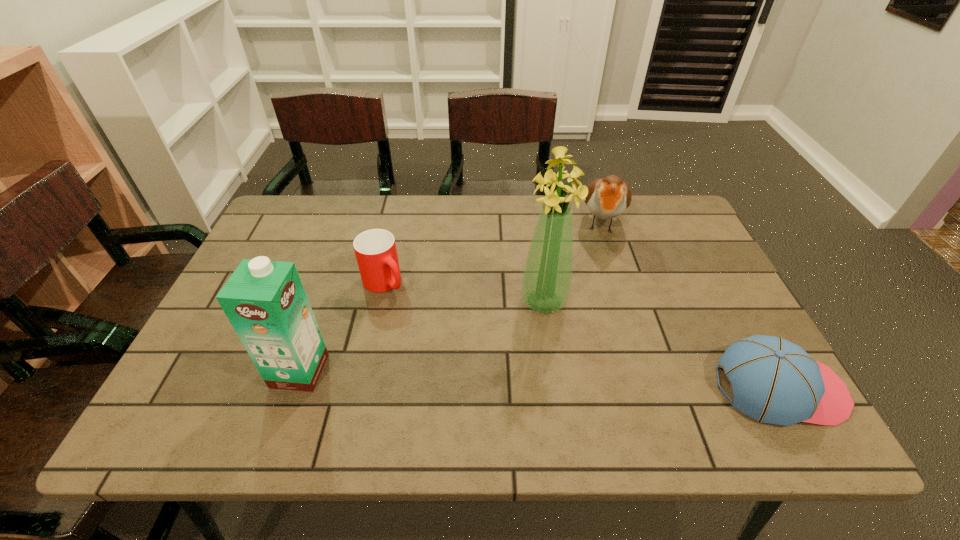
You are a GUI agent. You are given a task and a screenshot of the screen. Output one action in this format:
    pyautogui.click(x=<x>, y=<y>)
    Task: Click on the baseball cap that is at the near edge
    
    Given the screenshot: What is the action you would take?
    pyautogui.click(x=773, y=380)

Identify the location of object at the right edge. The height and width of the screenshot is (540, 960). (773, 380).

You are a GUI agent. You are given a task and a screenshot of the screen. Output one action in this format:
    pyautogui.click(x=<x>, y=<y>)
    Task: Click on the object present at the near right corner
    The width and height of the screenshot is (960, 540).
    Given the screenshot: What is the action you would take?
    pyautogui.click(x=773, y=380)

Image resolution: width=960 pixels, height=540 pixels. What are the coordinates of `vacant space at the far edge of the desktop` in the screenshot? It's located at click(331, 239).

This screenshot has width=960, height=540. I want to click on free location at the near edge, so click(x=402, y=386).

At what (x,y) coordinates should I click in order to perform the action: click on vacant space at the right edge of the desktop. Please return your answer as a coordinate pair (x, y). The image size is (960, 540). Looking at the image, I should click on tap(709, 331).

At what (x,y) coordinates should I click in order to perform the action: click on vacant area at the far left corner. Please return your answer as a coordinate pair (x, y). Looking at the image, I should click on (328, 206).

I want to click on free space at the far right corner of the desktop, so click(671, 237).

Locate an element on the screen. This screenshot has height=540, width=960. vacant point located between the tallest object and the second tallest object is located at coordinates (421, 336).

You are a GUI agent. You are given a task and a screenshot of the screen. Output one action in this format:
    pyautogui.click(x=<x>, y=<y>)
    Task: Click on the free space that is in between the farthest object and the cup
    Image resolution: width=960 pixels, height=540 pixels.
    Given the screenshot: What is the action you would take?
    pyautogui.click(x=492, y=252)